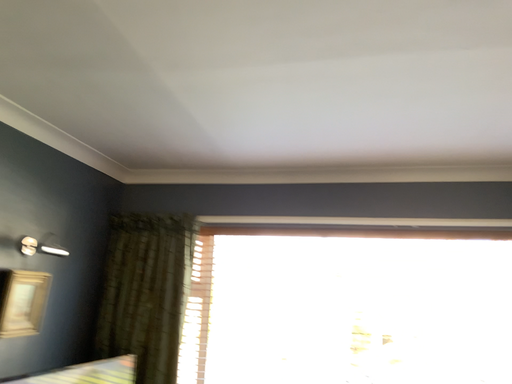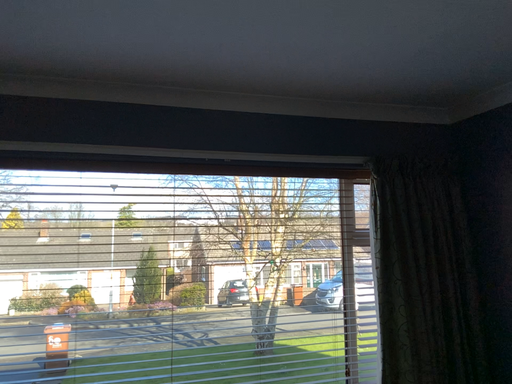
Question: How did the camera likely rotate when shooting the video?

Choices:
 (A) rotated upward
 (B) rotated downward

Answer: (B)